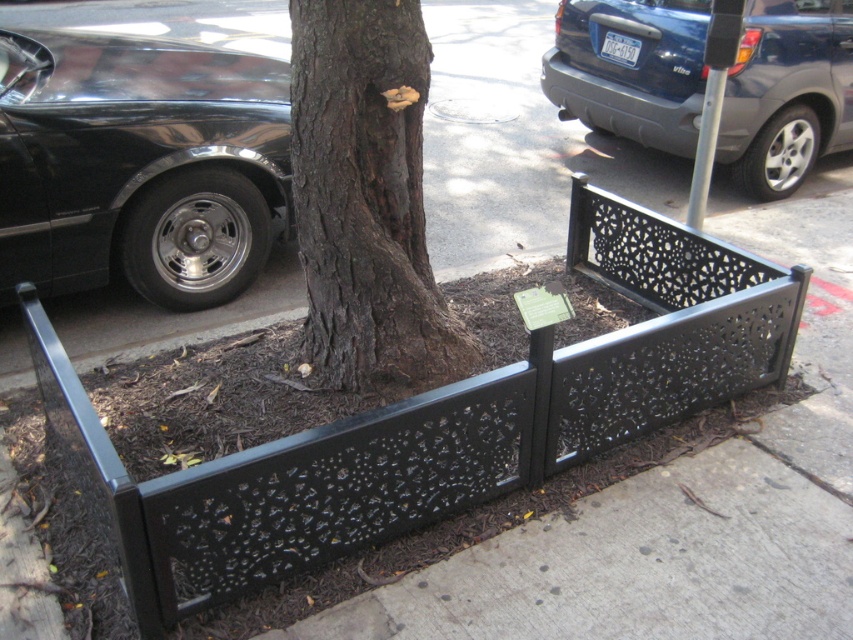
You are standing at the origin point of the image coordinate system. The origin is at the bottom left corner of the image. The coordinate system has x and y axes. The x axis increases to the right and the y axis increases upwards. You want to walk to the black perforated metal planter at center. In which direction should you move first? Please answer with either left, right, up, or down.

The black perforated metal planter at center is located at coordinate point 0.658 on the x axis and 0.513 on the y axis. Since you are at the origin point at the bottom left corner, your current position is at x 0 and y 0. To reach the planter, you should first move right along the x axis to increase your x coordinate towards 0.658. After reaching the correct x position, you can move up along the y axis to reach the y coordinate of 0.513. Therefore, the first direction you should move is right.

You are standing on the sidewalk looking at the tree in the planter. There are two points marked on the image. Which point, point (709, 282) or point (537, 320), is closer to you?

Point (709, 282) is closer to you because it is further to the viewer than point (537, 320).

You are standing on the sidewalk and want to place a new flower pot next to the black perforated metal planter at center. Where should you place it to ensure it is directly to the east of the existing planter?

To place the new flower pot directly to the east of the black perforated metal planter at center, you should position it at coordinates approximately (x=437, y=420) plus an eastward adjustment based on the desired distance. However, since the exact coordinate system isn